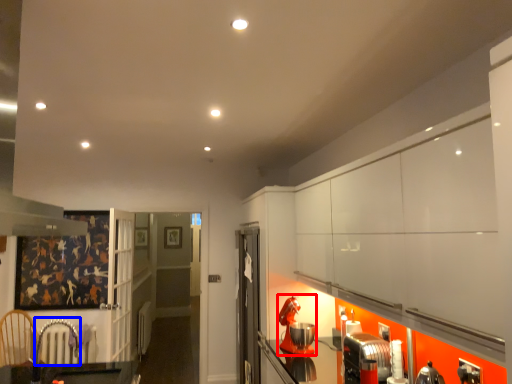
Question: Which object appears farthest to the camera in this image, appliance (highlighted by a red box) or armchair (highlighted by a blue box)?

Choices:
 (A) appliance
 (B) armchair

Answer: (A)